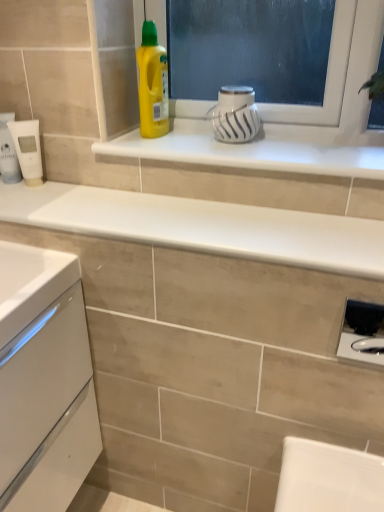
Identify the location of free space in front of white matte tube at left. The height and width of the screenshot is (512, 384). [x=21, y=200].